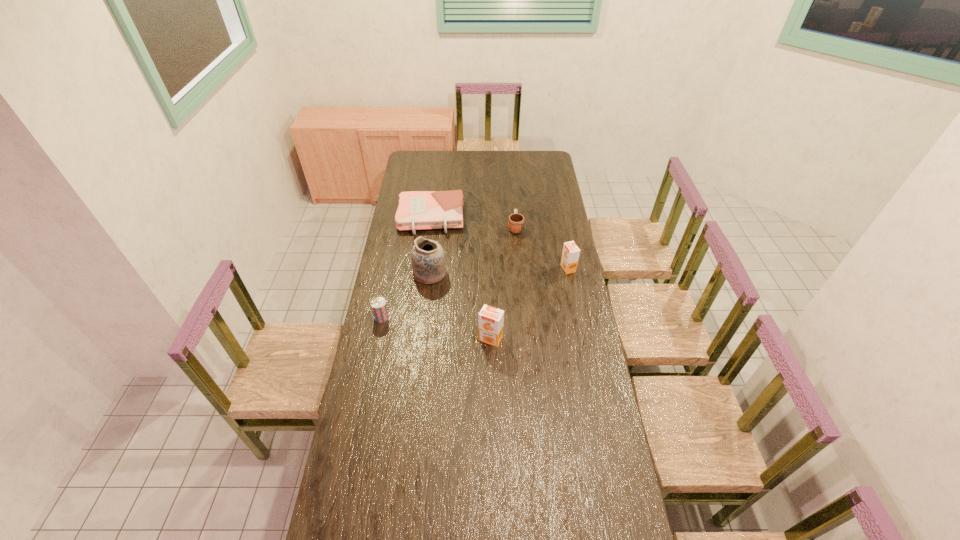
The width and height of the screenshot is (960, 540). What are the coordinates of `the nearest object` in the screenshot? It's located at (491, 319).

Identify the location of the left orange juice. This screenshot has height=540, width=960. [491, 319].

Find the location of a particular element. the right orange juice is located at coordinates (570, 255).

At what (x,y) coordinates should I click in order to perform the action: click on the farther orange juice. Please return your answer as a coordinate pair (x, y). The image size is (960, 540). Looking at the image, I should click on (570, 255).

You are a GUI agent. You are given a task and a screenshot of the screen. Output one action in this format:
    pyautogui.click(x=<x>, y=<y>)
    Task: Click on the fifth object from left to right
    The width and height of the screenshot is (960, 540).
    Given the screenshot: What is the action you would take?
    pyautogui.click(x=516, y=222)

Locate an element on the screen. Image resolution: width=960 pixels, height=540 pixels. pottery is located at coordinates pyautogui.click(x=428, y=260).

What are the coordinates of `phonebook` in the screenshot? It's located at (418, 210).

At what (x,y) coordinates should I click in order to perform the action: click on the fifth farthest object. Please return your answer as a coordinate pair (x, y). The width and height of the screenshot is (960, 540). Looking at the image, I should click on (378, 304).

The width and height of the screenshot is (960, 540). Identify the location of vacant region located on the back of the nearer orange juice. (491, 319).

Locate an element on the screen. vacant space situated 0.250m on the left of the rightmost object is located at coordinates (509, 268).